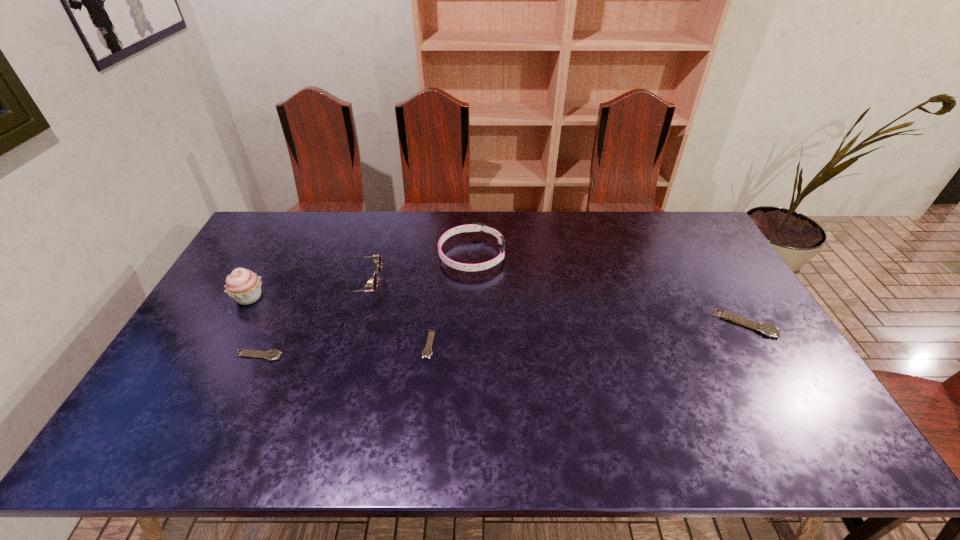
To make them evenly spaced by inserting another watch among them, please locate a vacant spot for this new watch. Please provide its 2D coordinates. Your answer should be formatted as a tuple, i.e. [(x, y)], where the tuple contains the x and y coordinates of a point satisfying the conditions above.

[(590, 334)]